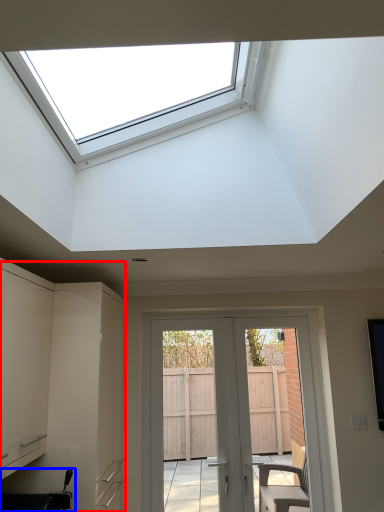
Question: Among these objects, which one is farthest to the camera, cabinetry (highlighted by a red box) or sink (highlighted by a blue box)?

Choices:
 (A) cabinetry
 (B) sink

Answer: (A)